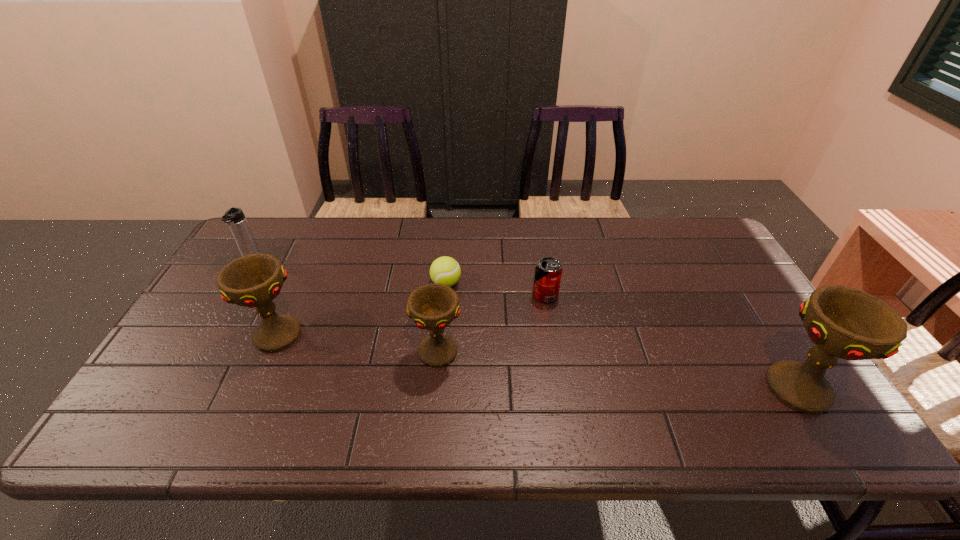
Find the location of a particular element. Image resolution: width=960 pixels, height=540 pixels. free point located on the right of the shortest chalice is located at coordinates (486, 352).

Find the location of a particular element. Image resolution: width=960 pixels, height=540 pixels. vacant space situated on the back of the rightmost chalice is located at coordinates (735, 288).

In order to click on free space located 0.080m on the left of the shortest object in this screenshot , I will do `click(404, 284)`.

Identify the location of free region located 0.140m on the left of the second shortest object. (485, 295).

Image resolution: width=960 pixels, height=540 pixels. Find the location of `vacant space located 0.310m on the handle side of the leftmost object`. vacant space located 0.310m on the handle side of the leftmost object is located at coordinates (200, 346).

This screenshot has width=960, height=540. In order to click on object that is at the far edge in this screenshot , I will do `click(234, 217)`.

Find the location of `object present at the near edge`. object present at the near edge is located at coordinates (843, 322).

Identify the location of object present at the left edge. This screenshot has width=960, height=540. (234, 217).

The width and height of the screenshot is (960, 540). I want to click on object at the right edge, so [843, 322].

Image resolution: width=960 pixels, height=540 pixels. Find the location of `object present at the far left corner`. object present at the far left corner is located at coordinates (234, 217).